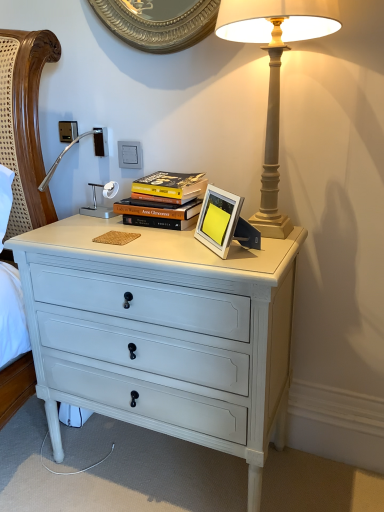
Question: Which is correct: white plastic electric outlet at upper center is inside hardcover books at center, or outside of it?

Choices:
 (A) inside
 (B) outside

Answer: (B)

Question: From the image's perspective, is white plastic electric outlet at upper center above or below hardcover books at center?

Choices:
 (A) below
 (B) above

Answer: (B)

Question: Estimate the real-world distances between objects in this image. Which object is farther from the white painted wood chest of drawers at center?

Choices:
 (A) hardcover books at center
 (B) matte beige lamp at upper right
 (C) white plastic electric outlet at upper center
 (D) silver metallic picture frame at center

Answer: (C)

Question: Considering the real-world distances, which object is farthest from the silver metallic picture frame at center?

Choices:
 (A) white plastic electric outlet at upper center
 (B) white painted wood chest of drawers at center
 (C) hardcover books at center
 (D) matte beige lamp at upper right

Answer: (A)